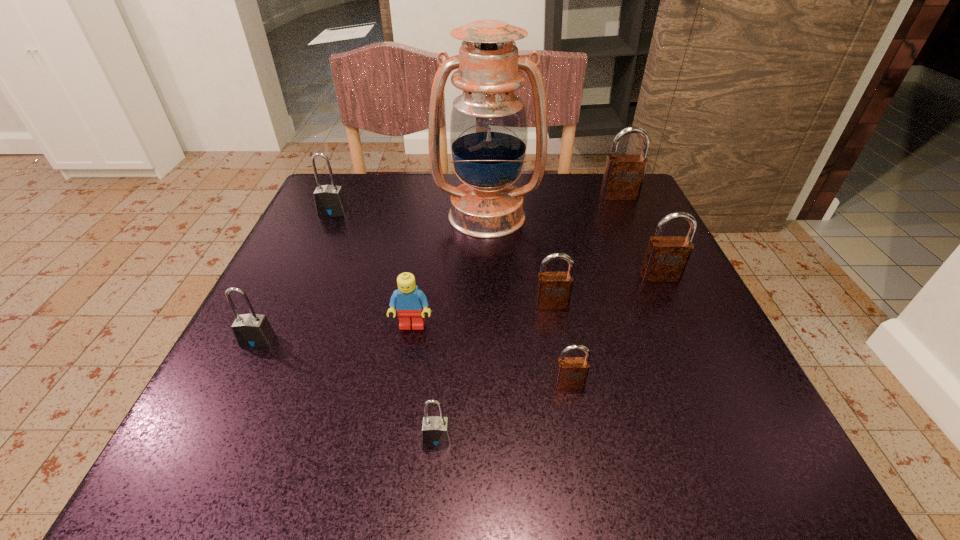
At what (x,y) coordinates should I click in order to perform the action: click on the fifth farthest object. Please return your answer as a coordinate pair (x, y). The height and width of the screenshot is (540, 960). Looking at the image, I should click on (554, 289).

Where is `the third biggest brown padlock`? the third biggest brown padlock is located at coordinates (554, 289).

Where is `Lego`? The height and width of the screenshot is (540, 960). Lego is located at coordinates (410, 302).

Where is `the smallest gray padlock`? This screenshot has width=960, height=540. the smallest gray padlock is located at coordinates (436, 431).

Where is `the nearest gray padlock`? The image size is (960, 540). the nearest gray padlock is located at coordinates (436, 431).

Where is `the smallest brown padlock`? the smallest brown padlock is located at coordinates (571, 373).

Locate an element on the screen. This screenshot has height=540, width=960. the nearest brown padlock is located at coordinates (571, 373).

Locate an element on the screen. vacant space situated on the left of the blue oil lamp is located at coordinates (336, 215).

The image size is (960, 540). In order to click on vacant area situated on the front-facing side of the biggest brown padlock in this screenshot , I will do `click(626, 211)`.

The width and height of the screenshot is (960, 540). I want to click on free region located on the shackle of the sixth nearest padlock, so click(311, 259).